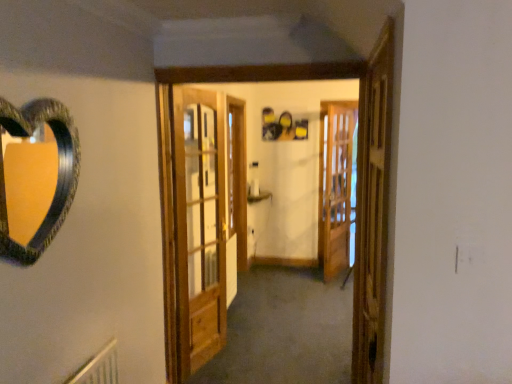
Where is `free spot to the right of wooden barn door at center`? free spot to the right of wooden barn door at center is located at coordinates (264, 359).